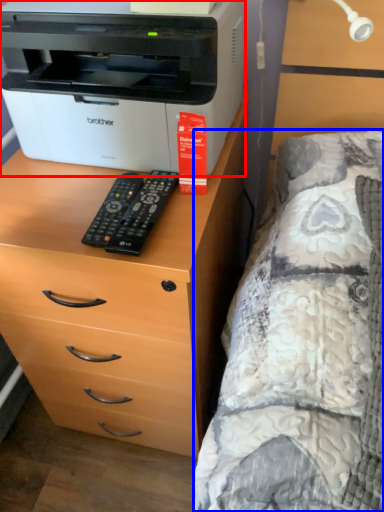
Question: Which object is further to the camera taking this photo, printer (highlighted by a red box) or bed (highlighted by a blue box)?

Choices:
 (A) printer
 (B) bed

Answer: (A)